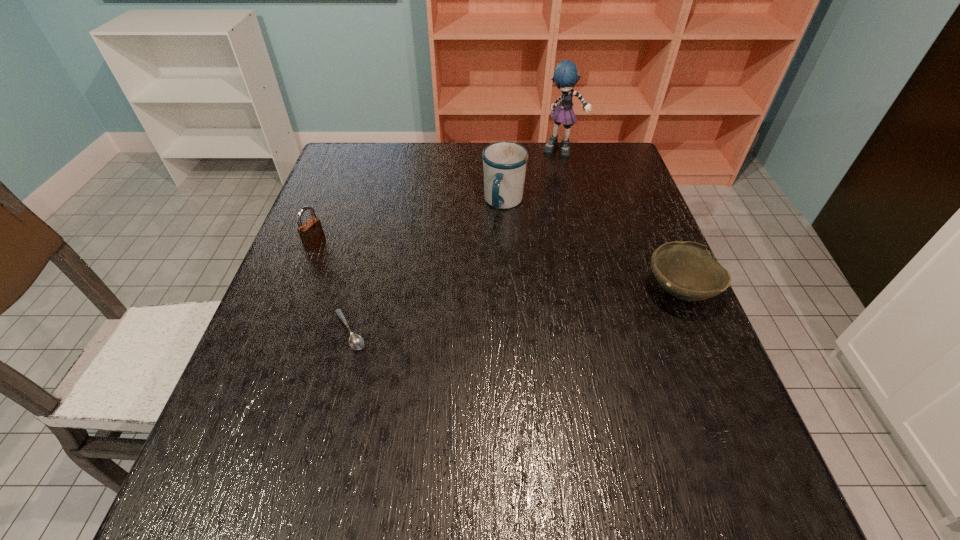
Where is `free location at the right edge`? The height and width of the screenshot is (540, 960). free location at the right edge is located at coordinates (642, 367).

At what (x,y) coordinates should I click in order to perform the action: click on free region at the far left corner of the desktop. Please return your answer as a coordinate pair (x, y). Image resolution: width=960 pixels, height=540 pixels. Looking at the image, I should click on (372, 180).

Where is `vacant area at the near left corner`? Image resolution: width=960 pixels, height=540 pixels. vacant area at the near left corner is located at coordinates (235, 419).

The width and height of the screenshot is (960, 540). Identify the location of free spot at the near right corner of the desktop. (660, 430).

Identify the location of free space between the shortest object and the leftmost object. (332, 287).

Where is `free point between the third farthest object and the tallest object`? The height and width of the screenshot is (540, 960). free point between the third farthest object and the tallest object is located at coordinates (439, 197).

Image resolution: width=960 pixels, height=540 pixels. In order to click on unoccupied position between the fourth object from right to left and the third shortest object in this screenshot , I will do `click(332, 287)`.

This screenshot has width=960, height=540. I want to click on free space between the mug and the fourth tallest object, so click(592, 246).

Locate an element on the screen. free space that is in between the third object from left to right and the fourth object from right to left is located at coordinates (426, 267).

Where is `vacant area that lies between the rightmost object and the leftmost object`? Image resolution: width=960 pixels, height=540 pixels. vacant area that lies between the rightmost object and the leftmost object is located at coordinates (497, 267).